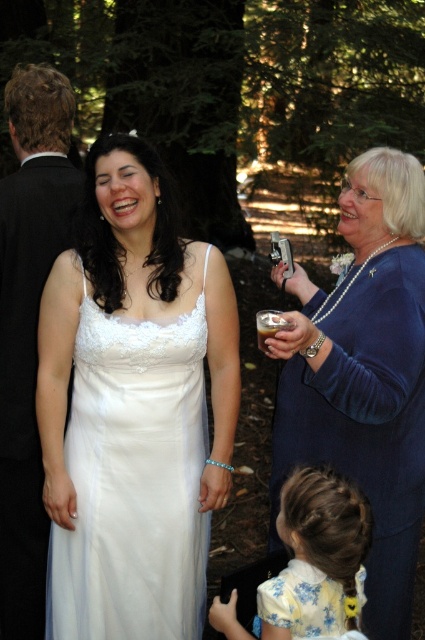
Question: Can you confirm if white satin dress at center is positioned to the left of black satin suit at left?

Choices:
 (A) no
 (B) yes

Answer: (A)

Question: Which of the following is the closest to the observer?

Choices:
 (A) yellow floral dress at lower center
 (B) floral silk dress at lower center
 (C) blue velvet dress at right

Answer: (A)

Question: Does yellow floral dress at lower center appear on the right side of floral silk dress at lower center?

Choices:
 (A) no
 (B) yes

Answer: (A)

Question: Which of the following is the closest to the observer?

Choices:
 (A) floral silk dress at lower center
 (B) white satin dress at center
 (C) blue velvet dress at right

Answer: (A)

Question: Which point is farther to the camera?

Choices:
 (A) (340, 417)
 (B) (362, 584)
 (C) (176, 506)
 (D) (56, 218)

Answer: (D)

Question: Does blue velvet dress at right come in front of floral silk dress at lower center?

Choices:
 (A) yes
 (B) no

Answer: (B)